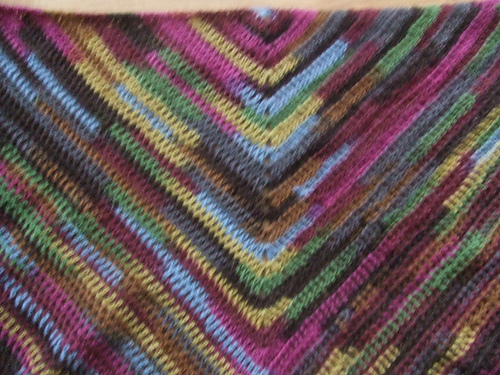
Where is `wrinkle in blanket`? wrinkle in blanket is located at coordinates (110, 332), (5, 197), (52, 223), (475, 239).